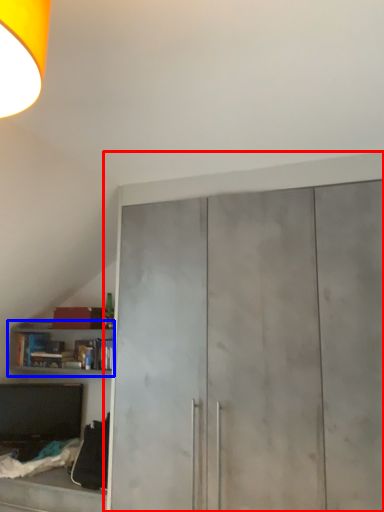
Question: Among these objects, which one is farthest to the camera, cupboard (highlighted by a red box) or cabinetry (highlighted by a blue box)?

Choices:
 (A) cupboard
 (B) cabinetry

Answer: (B)